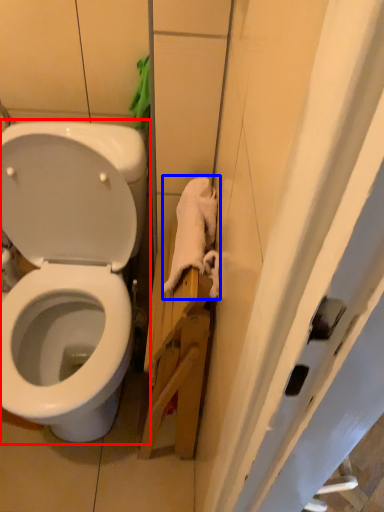
Question: Which point is closer to the camera, toilet (highlighted by a red box) or material (highlighted by a blue box)?

Choices:
 (A) toilet
 (B) material

Answer: (A)